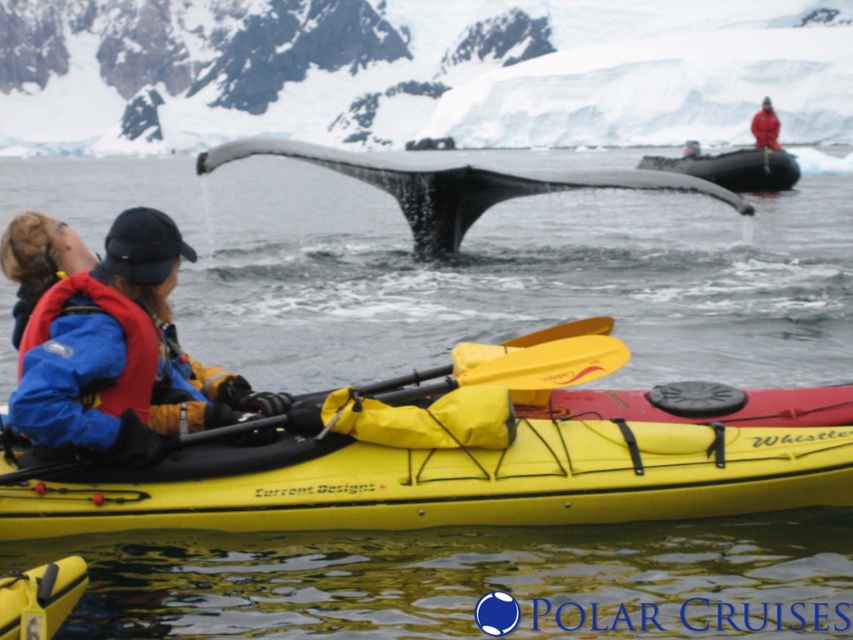
Between point (724, 428) and point (103, 404), which one is positioned in front?

Positioned in front is point (724, 428).

Is point (329, 516) farther from camera compared to point (158, 225)?

No.

This screenshot has width=853, height=640. I want to click on yellow matte kayak at lower center, so click(x=477, y=474).

Is point (560, 483) more distant than point (509, 189)?

That is False.

Measure the distance between point (813, 486) and camera.

Point (813, 486) and camera are 34.41 meters apart.

Where is `yellow matte kayak at lower center`? This screenshot has width=853, height=640. yellow matte kayak at lower center is located at coordinates (477, 474).

Does blue fabric jacket at lower left appear on the right side of matte blue life jacket at left?

No, blue fabric jacket at lower left is not to the right of matte blue life jacket at left.

Which of these two, blue fabric jacket at lower left or matte blue life jacket at left, stands shorter?

matte blue life jacket at left is shorter.

Is point (155, 451) positioned after point (56, 355)?

No, (155, 451) is closer to viewer.

At what (x,y) coordinates should I click in order to perform the action: click on blue fabric jacket at lower left. Please return your answer as a coordinate pair (x, y). Image resolution: width=853 pixels, height=640 pixels. Looking at the image, I should click on (120, 355).